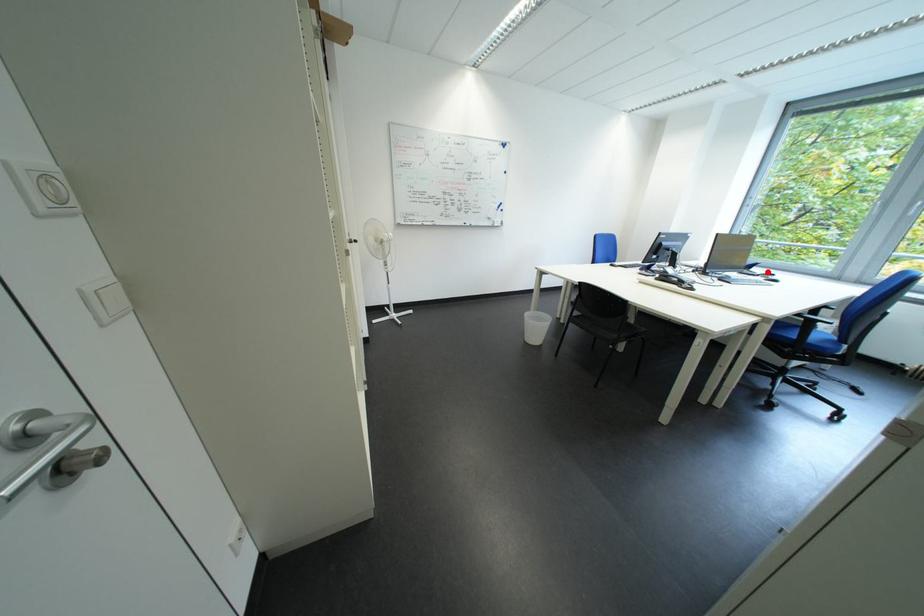
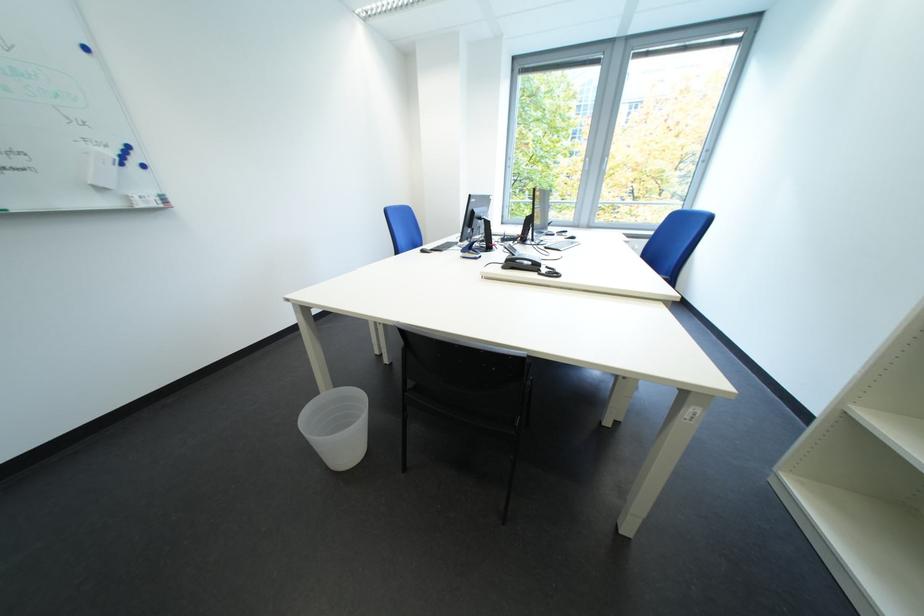
Locate, in the second image, the point that corresponds to the highlighted location in the first image.

(563, 232)